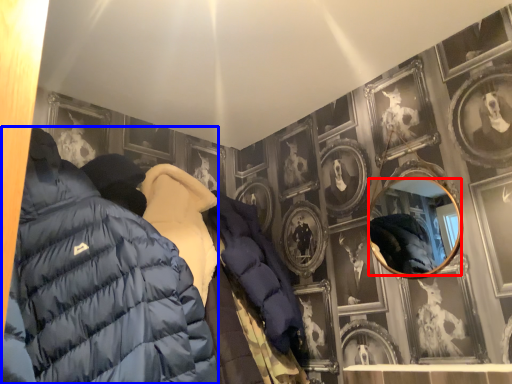
Question: Which object appears closest to the camera in this image, mirror (highlighted by a red box) or jacket (highlighted by a blue box)?

Choices:
 (A) mirror
 (B) jacket

Answer: (B)